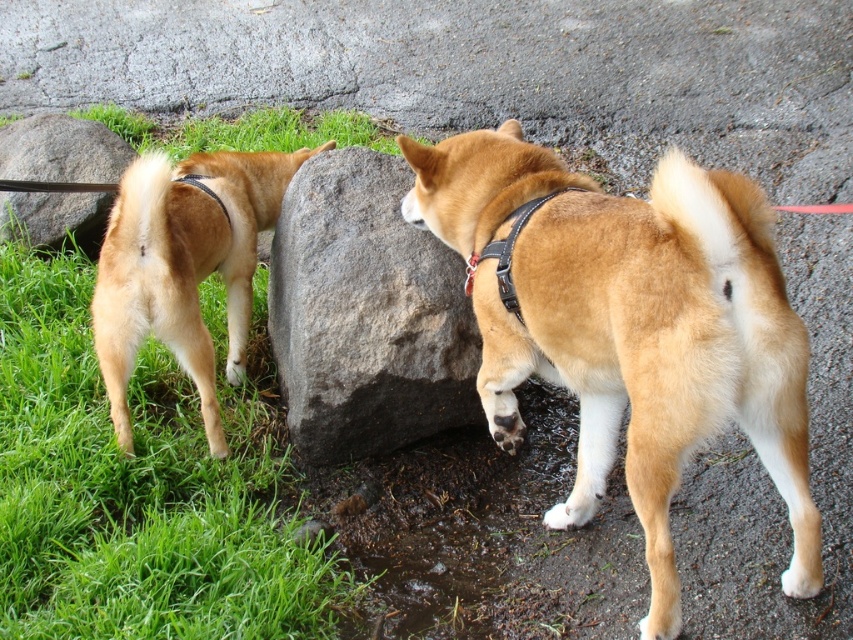
Question: Which object appears closest to the camera in this image?

Choices:
 (A) golden fur dog at left
 (B) gray rough rock at center
 (C) black leather neckband at center

Answer: (C)

Question: Is golden fur dog at left to the right of gray rock at center from the viewer's perspective?

Choices:
 (A) no
 (B) yes

Answer: (B)

Question: Which point is closer to the camera?

Choices:
 (A) (473, 273)
 (B) (196, 586)
 (C) (47, 216)

Answer: (B)

Question: Which of the following is the farthest from the observer?

Choices:
 (A) black leather neckband at center
 (B) golden fur dog at left

Answer: (B)

Question: Can you confirm if golden fur dog at center is smaller than golden fur dog at left?

Choices:
 (A) yes
 (B) no

Answer: (B)

Question: Is green grass at lower left above golden fur dog at left?

Choices:
 (A) yes
 (B) no

Answer: (B)